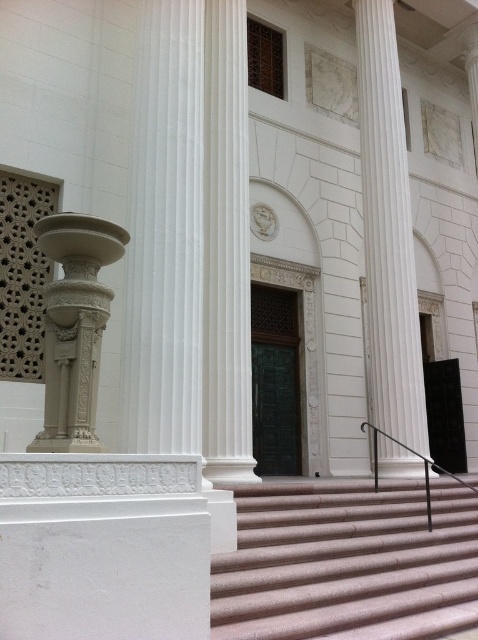
Question: Can you confirm if pink textured stairs at center is positioned above black metal/rail at center-right?

Choices:
 (A) no
 (B) yes

Answer: (A)

Question: Among these points, which one is farthest from the camera?

Choices:
 (A) (280, 589)
 (B) (373, 483)

Answer: (B)

Question: Does pink textured stairs at center appear on the left side of white carved stone column at left?

Choices:
 (A) no
 (B) yes

Answer: (A)

Question: Among these points, which one is farthest from the camera?

Choices:
 (A) (215, 582)
 (B) (380, 428)
 (C) (56, 284)
 (D) (377, 435)

Answer: (B)

Question: Which object is the farthest from the pink textured stairs at center?

Choices:
 (A) black metal/rail at center-right
 (B) white marble column at center
 (C) white carved stone column at left

Answer: (B)

Question: Does pink textured stairs at center have a larger size compared to white carved stone column at left?

Choices:
 (A) yes
 (B) no

Answer: (A)